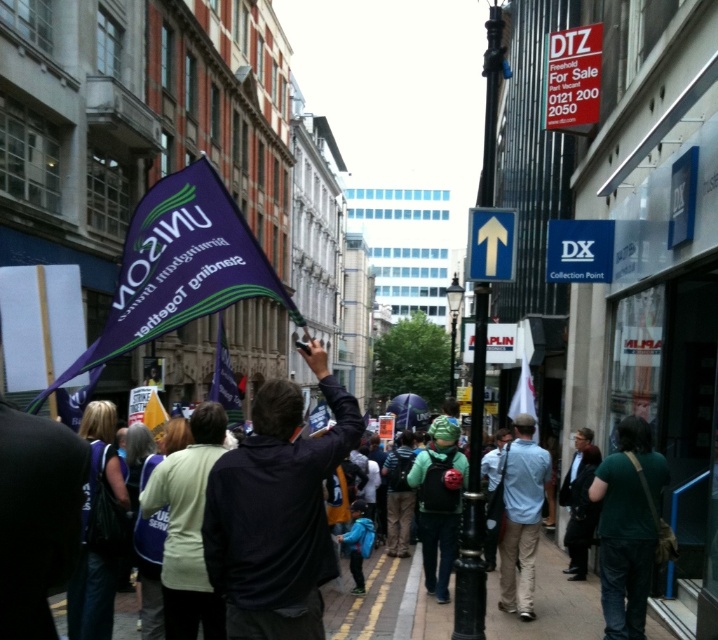
In the scene shown: Is green fabric jacket at center closer to camera compared to black metal pole at center?

That is True.

Which is more to the left, green fabric jacket at center or black metal pole at center?

green fabric jacket at center

Is point (192, 566) positioned in front of point (488, 168)?

Yes, point (192, 566) is closer to viewer.

The image size is (718, 640). I want to click on green fabric jacket at center, so click(x=187, y=528).

Is dark blue jacket at center above green matte jacket at center?

Correct, dark blue jacket at center is located above green matte jacket at center.

Does dark blue jacket at center have a greater height compared to green matte jacket at center?

In fact, dark blue jacket at center may be shorter than green matte jacket at center.

Is point (261, 465) behind point (442, 452)?

No, (261, 465) is closer to viewer.

Identify the location of dark blue jacket at center. pos(276,512).

Is light blue shirt at center to the left of green matte jacket at center from the viewer's perspective?

No, light blue shirt at center is not to the left of green matte jacket at center.

Who is higher up, light blue shirt at center or green matte jacket at center?

light blue shirt at center is higher up.

At what (x,y) coordinates should I click in order to perform the action: click on light blue shirt at center. Please return your answer as a coordinate pair (x, y). The width and height of the screenshot is (718, 640). Looking at the image, I should click on (521, 515).